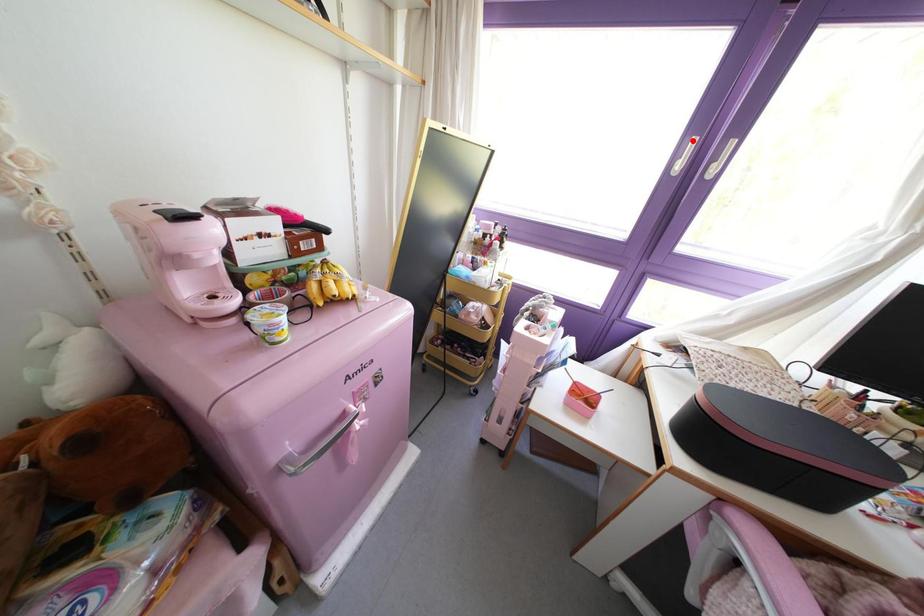
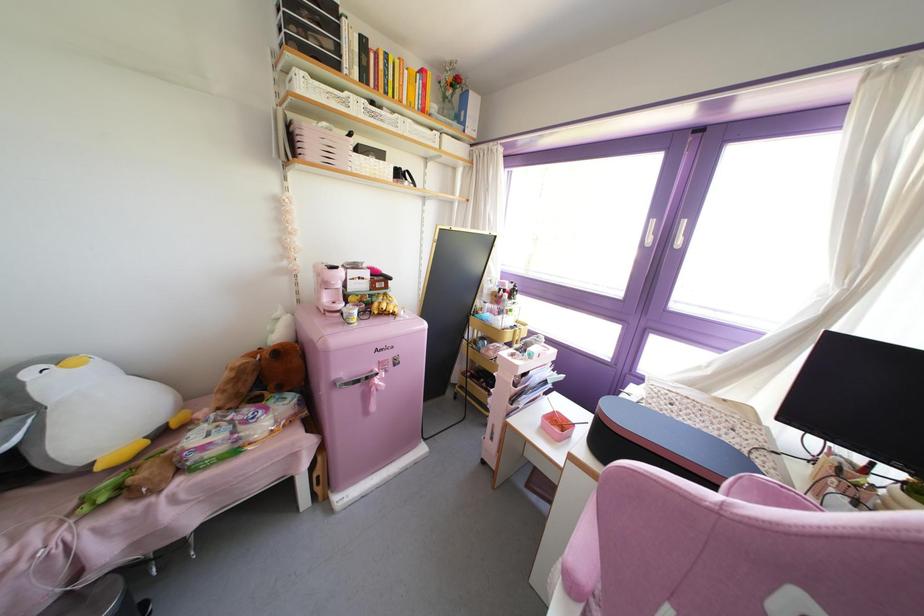
In the second image, find the point that corresponds to the highlighted location in the first image.

(652, 222)